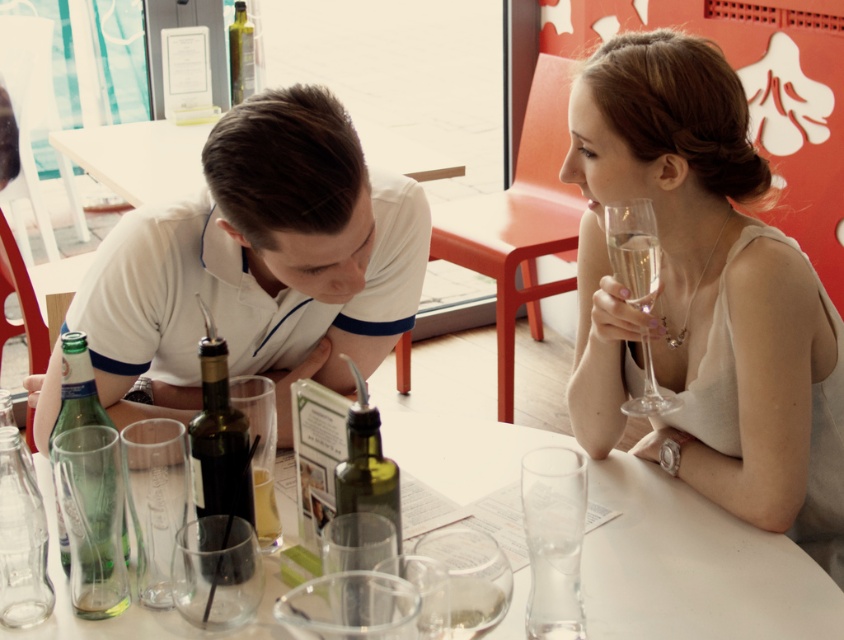
Between point (369, 444) and point (95, 397), which one is positioned behind?

The point (95, 397) is behind.

Does green glass bottle at center appear over green glass bottle at lower left?

No.

This screenshot has width=844, height=640. What do you see at coordinates (366, 465) in the screenshot? I see `green glass bottle at center` at bounding box center [366, 465].

Find the location of `green glass bottle at center`. green glass bottle at center is located at coordinates (366, 465).

Who is positioned more to the right, clear glassware at center or dark green glass bottle at center?

clear glassware at center is more to the right.

Does clear glassware at center have a greater height compared to dark green glass bottle at center?

No, clear glassware at center is not taller than dark green glass bottle at center.

Is point (518, 579) positioned before point (203, 493)?

That is False.

This screenshot has width=844, height=640. I want to click on clear glassware at center, so click(x=693, y=566).

Consider the image. Measure the distance between clear glassware at center and camera.

They are 91.81 centimeters apart.

Who is lower down, clear glassware at center or clear crystal wine glass at upper right?

clear glassware at center is lower down.

This screenshot has width=844, height=640. What are the coordinates of `clear glassware at center` in the screenshot? It's located at (693, 566).